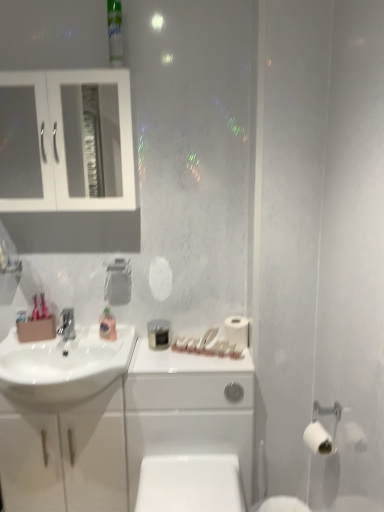
You are a GUI agent. You are given a task and a screenshot of the screen. Output one action in this format:
    pyautogui.click(x=<x>, y=<y>)
    Task: Click on the free spot above white glossy porcelain at center (from a real-world perspective)
    The width and height of the screenshot is (384, 512).
    Given the screenshot: What is the action you would take?
    pyautogui.click(x=147, y=355)